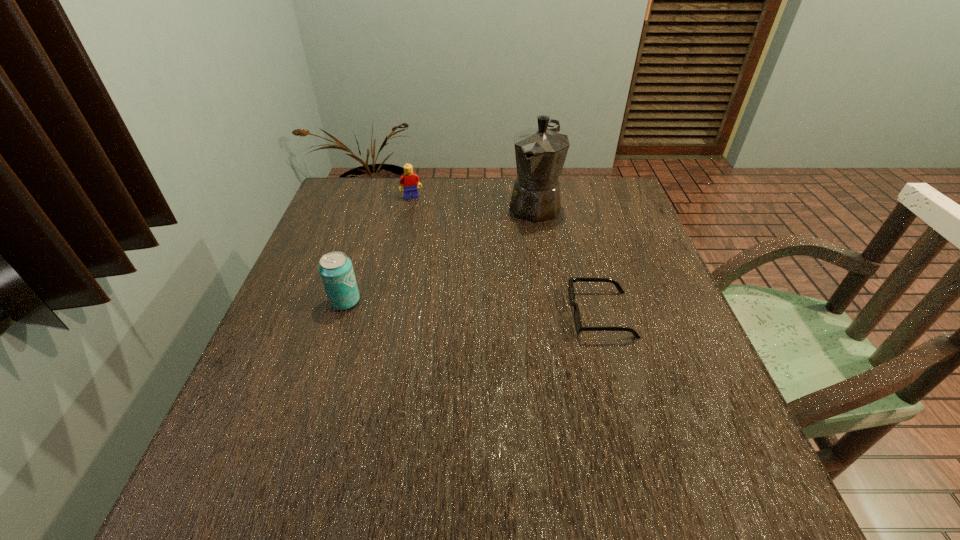
The width and height of the screenshot is (960, 540). I want to click on blank space located on the face of the Lego, so click(x=420, y=214).

Where is `vacant region located on the pouring side of the tallest object`? This screenshot has height=540, width=960. vacant region located on the pouring side of the tallest object is located at coordinates (500, 265).

The width and height of the screenshot is (960, 540). In order to click on vacant space located 0.250m on the pouring side of the tallest object in this screenshot , I will do `click(491, 279)`.

This screenshot has width=960, height=540. I want to click on free space located on the pouring side of the tallest object, so click(465, 318).

This screenshot has width=960, height=540. I want to click on Lego at the far edge, so click(x=410, y=181).

At what (x,y) coordinates should I click in order to perform the action: click on coffeepot present at the far edge. Please return your answer as a coordinate pair (x, y). Looking at the image, I should click on (540, 152).

Locate an element on the screen. object that is at the left edge is located at coordinates (336, 271).

In order to click on object that is at the right edge in this screenshot , I will do `click(571, 291)`.

What are the coordinates of `vacant space at the far edge of the desktop` in the screenshot? It's located at (563, 212).

In the image, there is a desktop. Where is `vacant space at the near edge`? Image resolution: width=960 pixels, height=540 pixels. vacant space at the near edge is located at coordinates (407, 441).